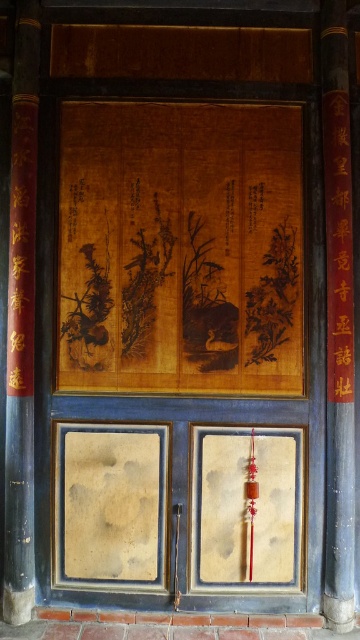
Which of these two, black wood pillar at right or black wood pillar at left, stands taller?

black wood pillar at left

Does black wood pillar at right have a larger size compared to black wood pillar at left?

No.

Which is behind, point (345, 440) or point (33, 324)?

The point (33, 324) is behind.

Identify the location of black wood pillar at right. (338, 321).